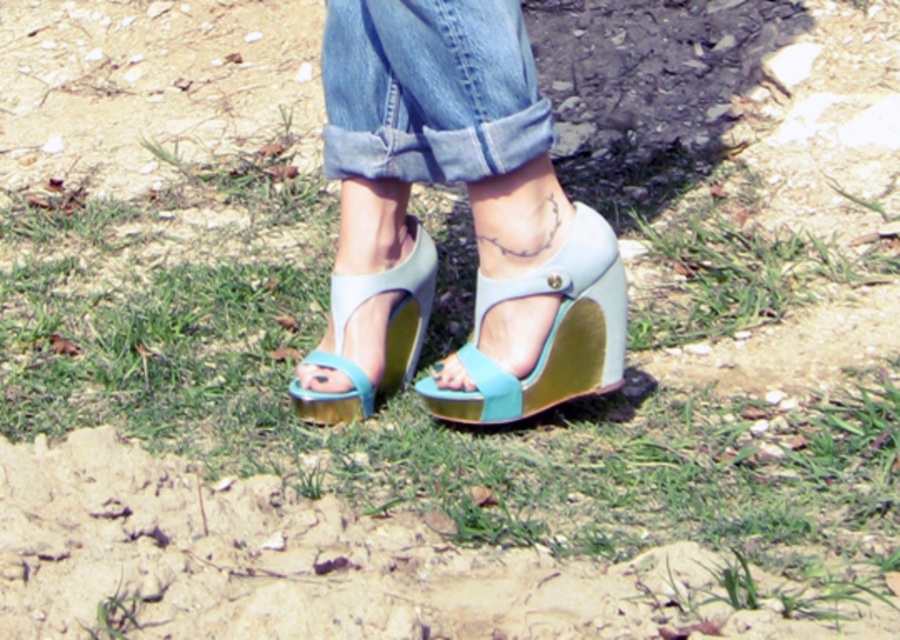
Question: Can you confirm if matte blue wedge sandals at center is thinner than light blue suede wedge at center?

Choices:
 (A) yes
 (B) no

Answer: (B)

Question: Which object is closer to the camera taking this photo?

Choices:
 (A) matte blue wedge sandals at center
 (B) light blue suede wedge at center
 (C) denim at center

Answer: (C)

Question: Which of these objects is positioned closest to the light blue leather sandal at center?

Choices:
 (A) light blue suede wedge at center
 (B) denim at center
 (C) matte blue wedge sandals at center

Answer: (C)

Question: Estimate the real-world distances between objects in this image. Which object is farther from the light blue suede wedge at center?

Choices:
 (A) light blue leather sandal at center
 (B) denim at center
 (C) matte blue wedge sandals at center

Answer: (B)

Question: From the image, what is the correct spatial relationship of matte blue wedge sandals at center in relation to denim at center?

Choices:
 (A) right
 (B) left

Answer: (A)

Question: Is denim at center above light blue leather sandal at center?

Choices:
 (A) no
 (B) yes

Answer: (B)